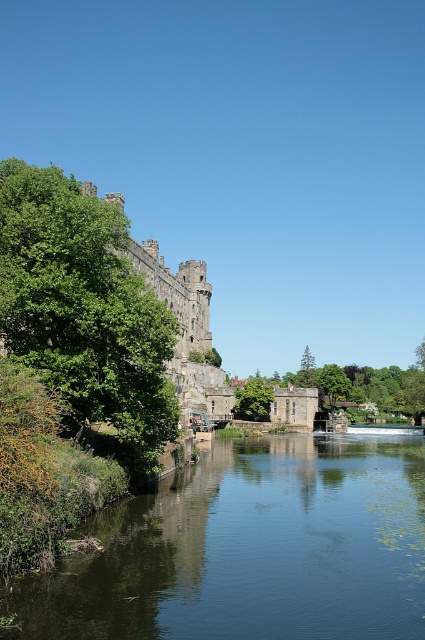
Is green leafy tree at left thinner than green leafy tree at center?

No, green leafy tree at left is not thinner than green leafy tree at center.

Who is more forward, (65, 284) or (252, 381)?

Point (65, 284)

At what (x,y) coordinates should I click in order to perform the action: click on green leafy tree at left. Please return your answer as a coordinate pair (x, y). Looking at the image, I should click on (85, 310).

Where is `dark blue water at center`? dark blue water at center is located at coordinates (251, 548).

Is point (172, 573) positioned before point (244, 412)?

Yes.

Locate an element on the screen. The height and width of the screenshot is (640, 425). dark blue water at center is located at coordinates (251, 548).

Measure the distance between dark blue water at center and camera.

173.94 feet

The height and width of the screenshot is (640, 425). Find the location of `dark blue water at center`. dark blue water at center is located at coordinates (251, 548).

Find the location of a particular element. dark blue water at center is located at coordinates (251, 548).